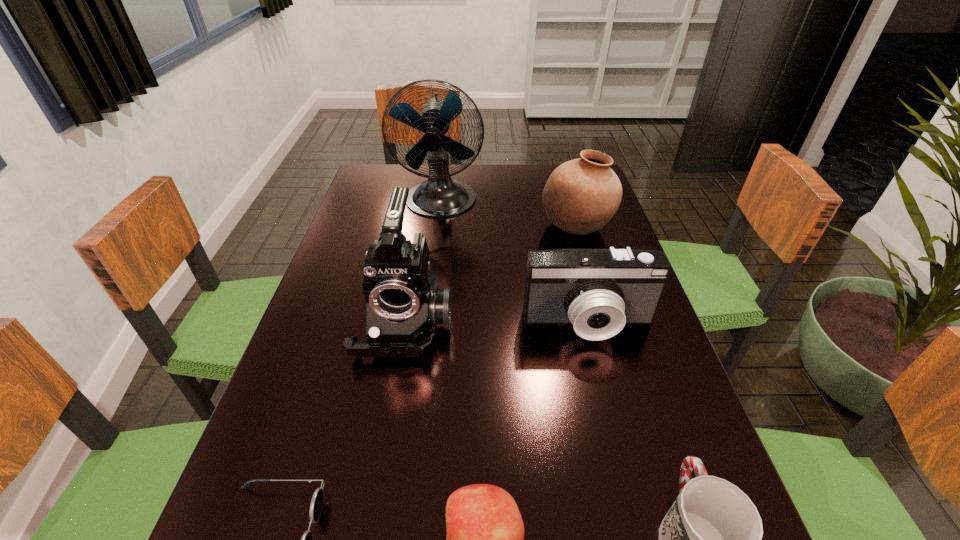
You are a GUI agent. You are given a task and a screenshot of the screen. Output one action in this format:
    pyautogui.click(x=<x>, y=<y>)
    Task: Click on the object situated at the far edge
    
    Given the screenshot: What is the action you would take?
    pyautogui.click(x=440, y=196)

In order to click on fan situated at the left edge in this screenshot , I will do `click(440, 196)`.

The image size is (960, 540). I want to click on camcorder located in the left edge section of the desktop, so click(x=404, y=308).

This screenshot has height=540, width=960. Identify the location of pottery that is positioned at the right edge. (580, 197).

Locate an element on the screen. Image resolution: width=960 pixels, height=540 pixels. camcorder at the right edge is located at coordinates (598, 291).

Locate an element on the screen. object at the far left corner is located at coordinates (440, 196).

At what (x,y) coordinates should I click in order to perform the action: click on vacant space at the far edge of the desktop. Please return your answer as a coordinate pair (x, y). The image size is (960, 540). Looking at the image, I should click on (513, 186).

Where is `vacant area at the left edge`? Image resolution: width=960 pixels, height=540 pixels. vacant area at the left edge is located at coordinates (272, 470).

You are a GUI agent. You are given a task and a screenshot of the screen. Output one action in this format:
    pyautogui.click(x=<x>, y=<y>)
    Task: Click on the vacant space at the right edge
    This screenshot has height=540, width=960.
    Given the screenshot: What is the action you would take?
    pyautogui.click(x=630, y=383)

Locate an element on the screen. This screenshot has height=540, width=960. free space at the far left corner is located at coordinates (383, 197).